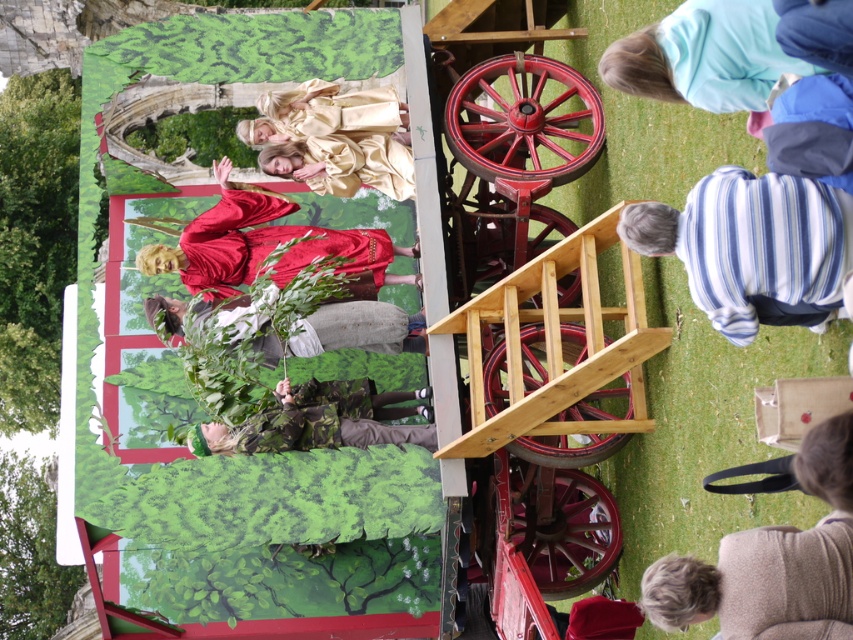
Question: Does striped cotton shirt at lower right have a larger size compared to camouflage fabric at center?

Choices:
 (A) yes
 (B) no

Answer: (A)

Question: Which object appears farthest from the camera in this image?

Choices:
 (A) camouflage fabric at center
 (B) camouflage fabric pants at center
 (C) gray wool sweater at lower right
 (D) matte red robe at center

Answer: (D)

Question: Does striped cotton shirt at lower right appear on the left side of matte red robe at center?

Choices:
 (A) no
 (B) yes

Answer: (A)

Question: Which object appears farthest from the camera in this image?

Choices:
 (A) striped cotton shirt at lower right
 (B) gray wool sweater at lower right

Answer: (A)

Question: Which point is farther from the camera taking this photo?

Choices:
 (A) (369, 240)
 (B) (167, 308)

Answer: (B)

Question: Can you confirm if striped cotton shirt at lower right is positioned above gray wool sweater at lower right?

Choices:
 (A) no
 (B) yes

Answer: (B)